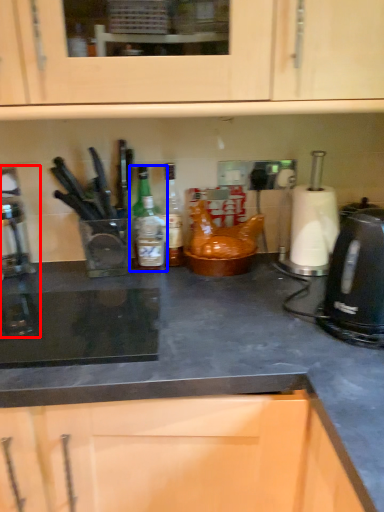
Question: Which of the following is the closest to the observer, coffee machine (highlighted by a red box) or kitchen appliance (highlighted by a blue box)?

Choices:
 (A) coffee machine
 (B) kitchen appliance

Answer: (A)